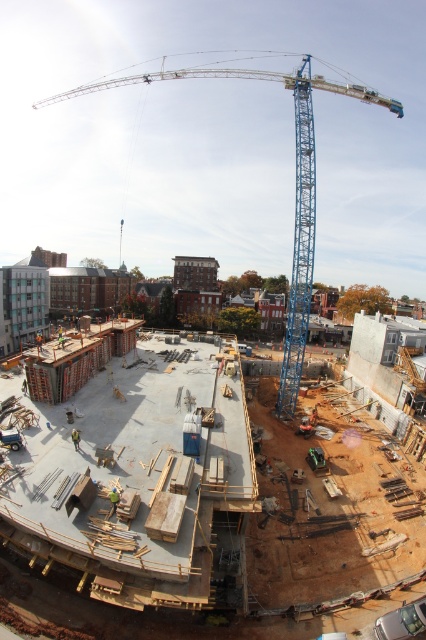
Can you confirm if green fabric construction worker at center is positioned above yellow reflective vest at center?

Incorrect, green fabric construction worker at center is not positioned above yellow reflective vest at center.

Consider the image. Can you confirm if green fabric construction worker at center is shorter than yellow reflective vest at center?

Correct, green fabric construction worker at center is not as tall as yellow reflective vest at center.

Between point (115, 506) and point (78, 444), which one is positioned behind?

Point (78, 444)

The width and height of the screenshot is (426, 640). In order to click on green fabric construction worker at center in this screenshot , I will do `click(114, 499)`.

Can you confirm if concrete slab at center is taller than green fabric construction worker at center?

Yes, concrete slab at center is taller than green fabric construction worker at center.

Is point (117, 397) closer to camera compared to point (112, 509)?

No.

What are the coordinates of `concrete slab at center` in the screenshot? It's located at (132, 467).

From the picture: Which is more to the right, blue metallic crane at upper center or green fabric construction worker at center?

From the viewer's perspective, green fabric construction worker at center appears more on the right side.

Measure the distance between blue metallic crane at upper center and camera.

114.48 feet

Is point (322, 80) farther from camera compared to point (112, 508)?

Yes.

Locate an element on the screen. blue metallic crane at upper center is located at coordinates (296, 189).